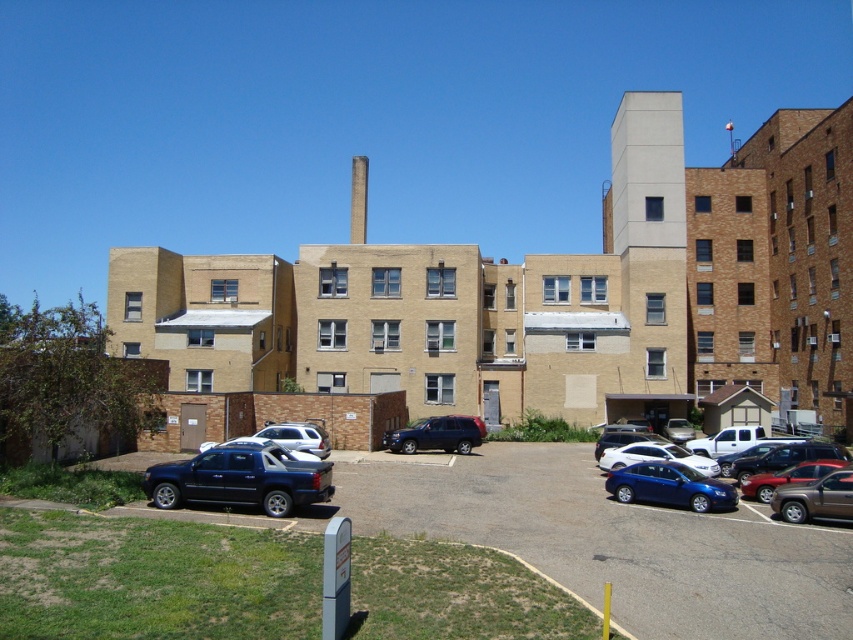
Question: Which object is farther from the camera taking this photo?

Choices:
 (A) satin black suv at center
 (B) shiny silver suv at lower right
 (C) matte blue sedan at center

Answer: (A)

Question: Among these objects, which one is farthest from the camera?

Choices:
 (A) matte black truck at lower left
 (B) white matte suv at center
 (C) metallic blue truck at lower left
 (D) matte blue sedan at center

Answer: (B)

Question: Is metallic blue truck at lower left above shiny blue sedan at right?

Choices:
 (A) yes
 (B) no

Answer: (B)

Question: Based on their relative distances, which object is nearer to the shiny blue sedan at lower right?

Choices:
 (A) white matte suv at center
 (B) satin black suv at center

Answer: (B)

Question: Does shiny blue sedan at lower right have a greater width compared to satin black suv at center?

Choices:
 (A) no
 (B) yes

Answer: (B)

Question: Does shiny blue sedan at lower right appear over shiny blue sedan at right?

Choices:
 (A) no
 (B) yes

Answer: (B)